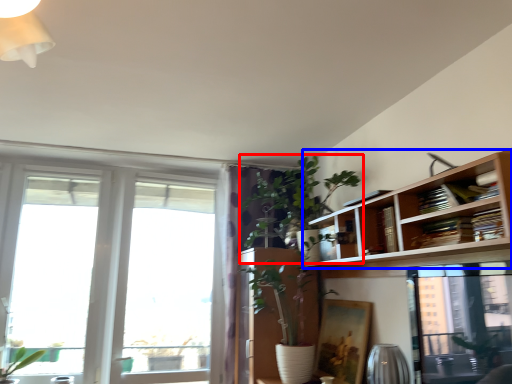
Question: Which object appears farthest to the camera in this image, houseplant (highlighted by a red box) or bookshelf (highlighted by a blue box)?

Choices:
 (A) houseplant
 (B) bookshelf

Answer: (A)